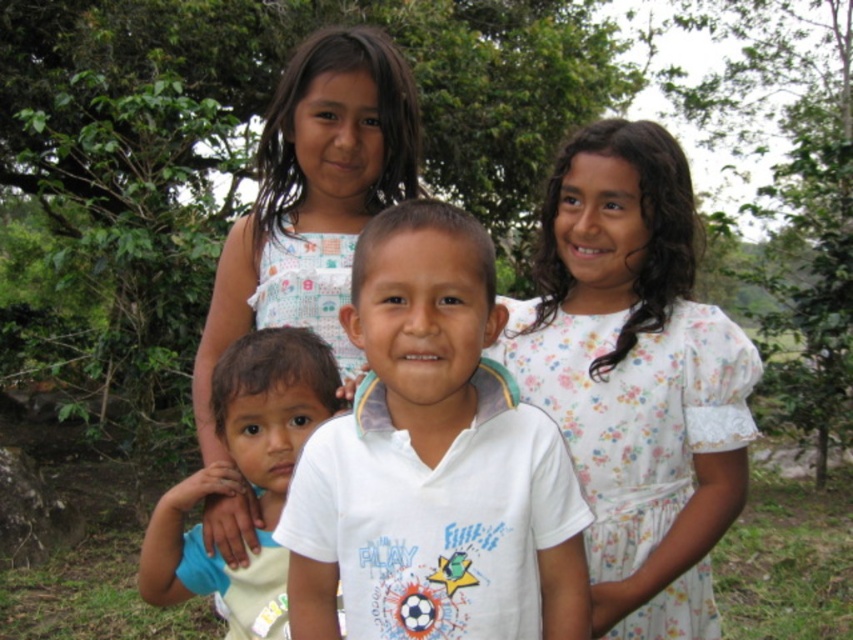
You are a photographer trying to capture the children in the scene. You notice the floral cotton dress at upper right. Based on its position, can you estimate whether it is closer to the top or the bottom of the image?

The floral cotton dress at upper right is located at point (636, 378), so it is closer to the top of the image since the y coordinate 0.747 is closer to 1.0 than 0.0 in the coordinate system where 0.0 is the bottom and 1.0 is the top.

You are a photographer trying to capture a group shot of the children. You want to ensure that the floral cotton dress at upper right and the light brown skin at center are both visible in the frame. Based on their positions, which child should be positioned closer to the front to avoid blocking the other?

The light brown skin at center should be positioned closer to the front since the floral cotton dress at upper right is currently above it, meaning the light brown skin at center is behind and might be blocked if not moved forward.

You are a photographer trying to capture a group photo of the children. You notice the white cotton shirt at center and the light brown skin at center. To ensure both are visible in the frame, should you adjust the camera to focus more on the left or the right side?

You should focus more on the right side because the white cotton shirt at center is to the right of the light brown skin at center, so adjusting the focus to the right will keep both in the frame.